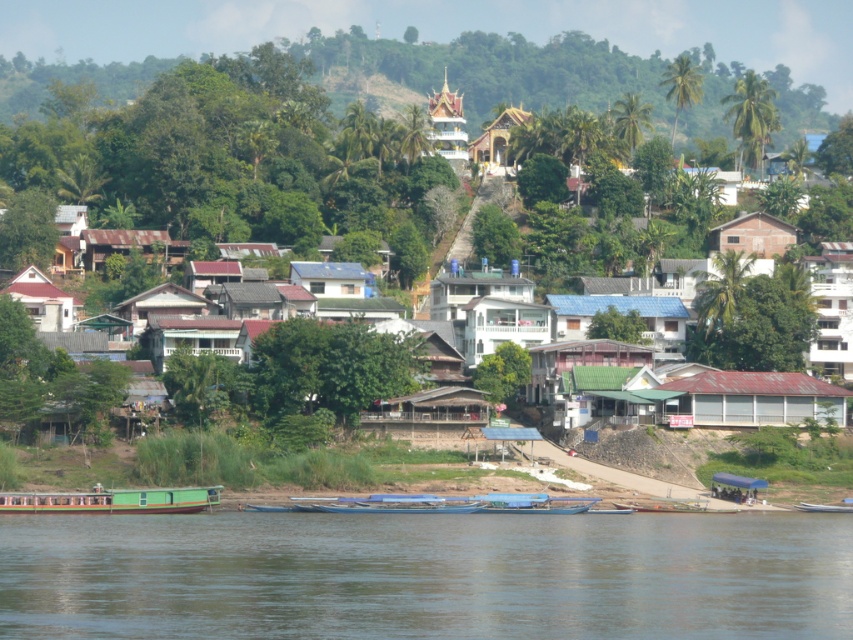
Is brown wooden hut at right smaller than white matte house at lower left?

Indeed, brown wooden hut at right has a smaller size compared to white matte house at lower left.

At what (x,y) coordinates should I click in order to perform the action: click on brown wooden hut at right. Please return your answer as a coordinate pair (x, y). The height and width of the screenshot is (640, 853). Looking at the image, I should click on (752, 236).

Find the location of a particular element. This screenshot has height=640, width=853. brown wooden hut at right is located at coordinates (752, 236).

Is white matte building at center to the right of white matte house at center from the viewer's perspective?

No, white matte building at center is not to the right of white matte house at center.

Is point (260, 132) positioned behind point (480, 291)?

Yes, it is.

Is point (256, 154) in front of point (511, 276)?

That is False.

The image size is (853, 640). Find the location of `white matte building at center`. white matte building at center is located at coordinates (236, 164).

Does brown matte water at lower center have a lesser height compared to rusty metal hut at lower right?

Indeed, brown matte water at lower center has a lesser height compared to rusty metal hut at lower right.

Can you confirm if brown matte water at lower center is taller than rusty metal hut at lower right?

Incorrect, brown matte water at lower center's height is not larger of rusty metal hut at lower right's.

This screenshot has width=853, height=640. What do you see at coordinates (426, 576) in the screenshot?
I see `brown matte water at lower center` at bounding box center [426, 576].

Find the location of a particular element. The width and height of the screenshot is (853, 640). brown matte water at lower center is located at coordinates (426, 576).